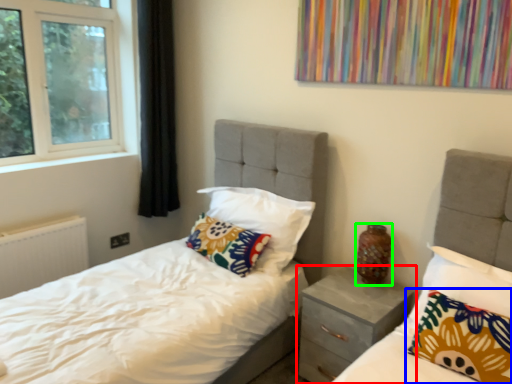
Question: Which object is positioned closest to nightstand (highlighted by a red box)? Select from pillow (highlighted by a blue box) and vase (highlighted by a green box).

Choices:
 (A) pillow
 (B) vase

Answer: (B)